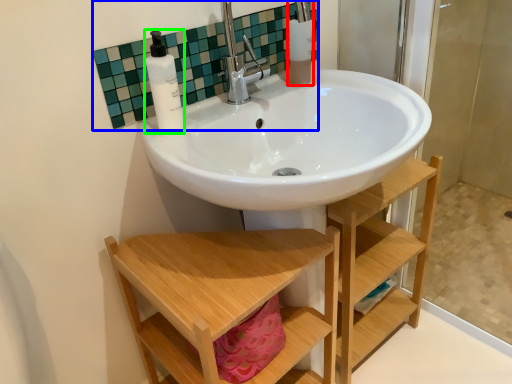
Question: Which is farther away from toiletry (highlighted by a red box)? mirror (highlighted by a blue box) or soap dispenser (highlighted by a green box)?

Choices:
 (A) mirror
 (B) soap dispenser

Answer: (B)